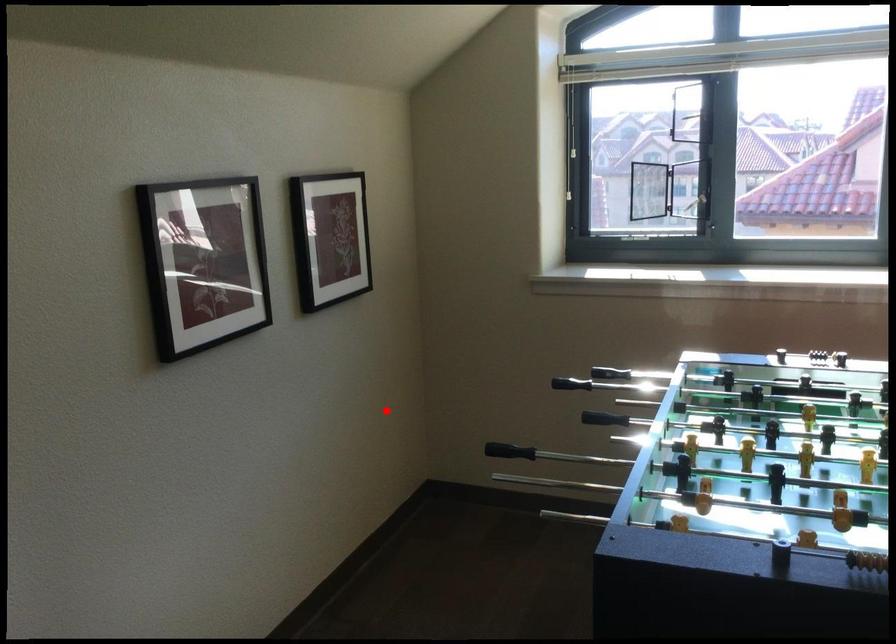
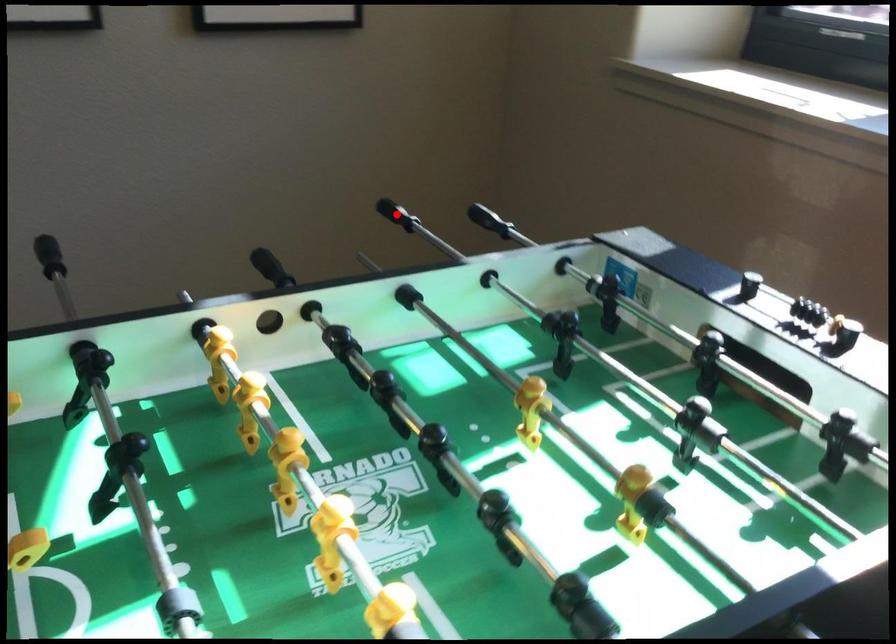
I am providing you with two images of the same scene from different viewpoints. A red point is marked on the first image and another point is marked on the second image. Does the point marked in image1 correspond to the same location as the one in image2?

Yes